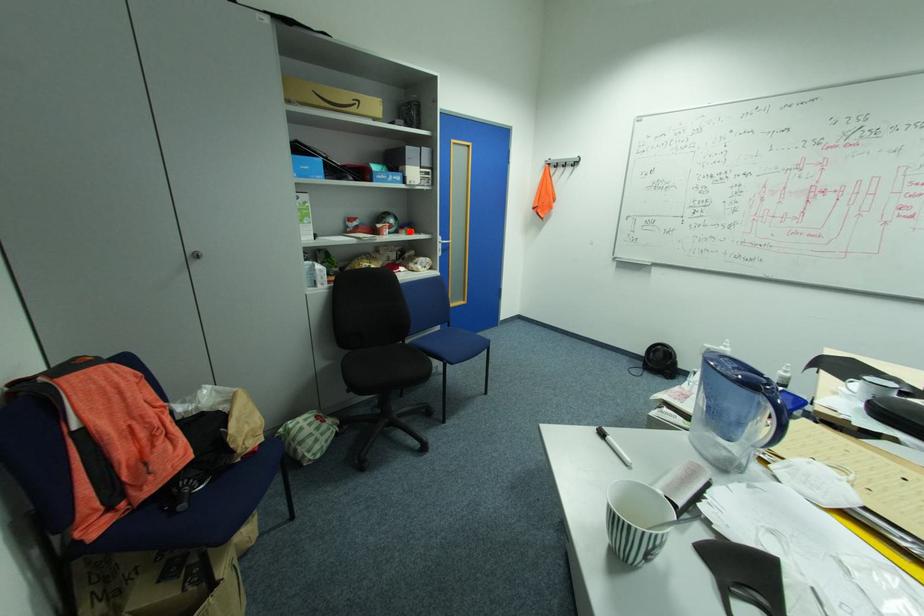
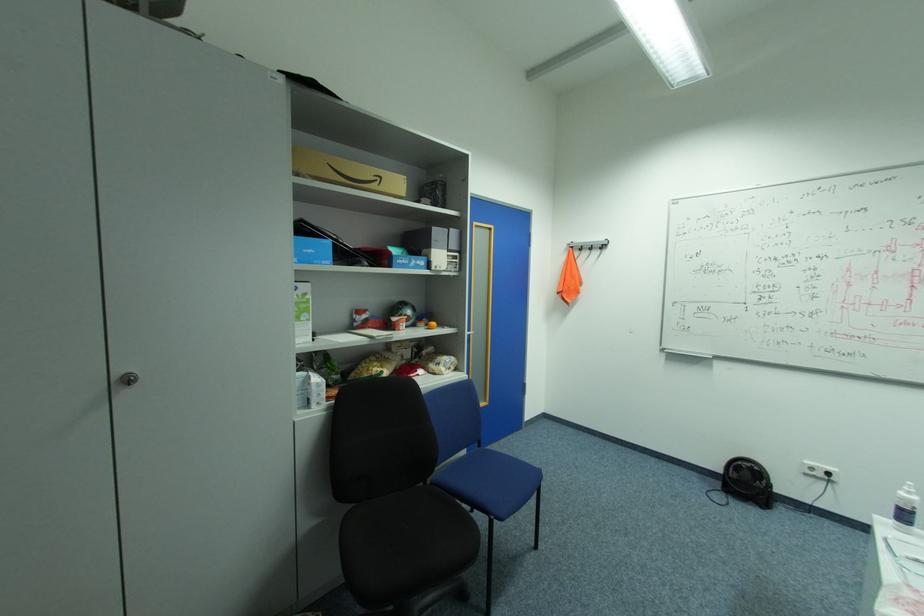
In the second image, find the point that corresponds to the highlighted location in the first image.

(429, 323)